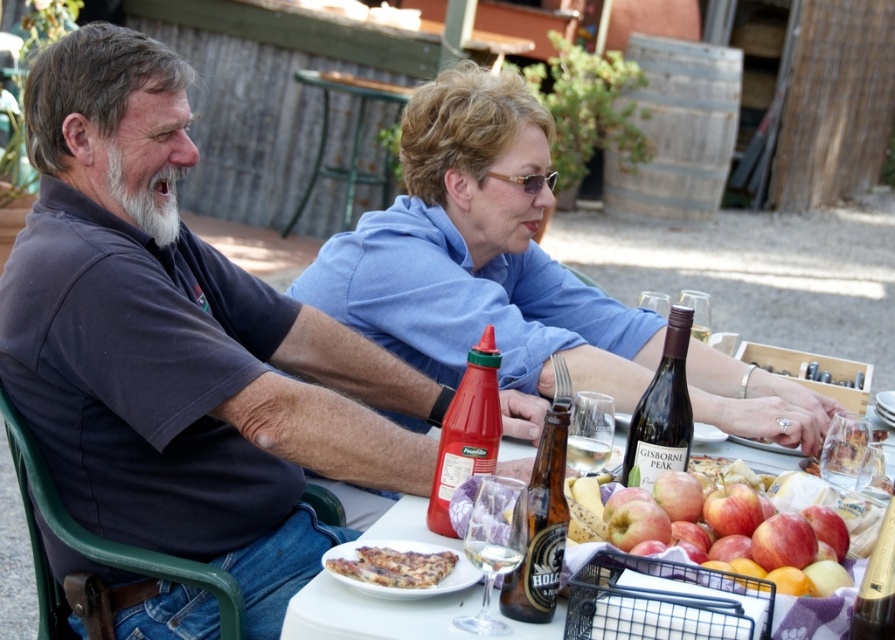
Question: Which point is closer to the camera?

Choices:
 (A) red matte apple at center
 (B) golden crispy pizza at center
 (C) green metal picnic table at upper center

Answer: (A)

Question: Can you confirm if red matte apple at center is thinner than matte plastic ketchup bottle at center?

Choices:
 (A) yes
 (B) no

Answer: (B)

Question: Which object appears closest to the camera in this image?

Choices:
 (A) brown glass beer bottle at center
 (B) green metal picnic table at upper center
 (C) matte glass wine bottle at center
 (D) matte plastic ketchup bottle at center

Answer: (A)

Question: Does blue cotton shirt at center have a greater width compared to green metal picnic table at upper center?

Choices:
 (A) yes
 (B) no

Answer: (A)

Question: Does red matte apple at center have a greater width compared to red matte apple at lower center?

Choices:
 (A) yes
 (B) no

Answer: (A)

Question: Which point appears farthest from the camera in this image?

Choices:
 (A) (550, 540)
 (B) (774, 538)
 (C) (469, 541)
 (D) (296, 72)

Answer: (D)